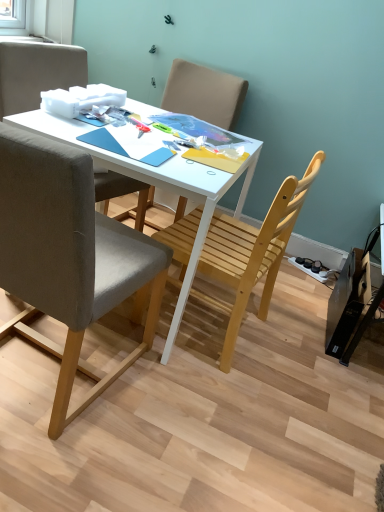
The height and width of the screenshot is (512, 384). Describe the element at coordinates (68, 256) in the screenshot. I see `gray fabric chair at left, acting as the 4th chair starting from the back` at that location.

The height and width of the screenshot is (512, 384). What do you see at coordinates (204, 93) in the screenshot?
I see `light brown wooden chair at center, which is counted as the 1th chair, starting from the back` at bounding box center [204, 93].

The height and width of the screenshot is (512, 384). I want to click on gray fabric chair at left, acting as the 4th chair starting from the back, so click(68, 256).

Is light wood chair at center, placed as the second chair when sorted from front to back, in front of or behind gray fabric chair at left, acting as the 4th chair starting from the back, in the image?

light wood chair at center, placed as the second chair when sorted from front to back, is positioned farther from the viewer than gray fabric chair at left, acting as the 4th chair starting from the back.

Does light wood chair at center, placed as the second chair when sorted from front to back, have a lesser height compared to gray fabric chair at left, acting as the 4th chair starting from the back?

Yes.

Considering the sizes of objects light wood chair at center, placed as the second chair when sorted from front to back, and gray fabric chair at left, which is counted as the first chair, starting from the front, in the image provided, who is smaller, light wood chair at center, placed as the second chair when sorted from front to back, or gray fabric chair at left, which is counted as the first chair, starting from the front,?

light wood chair at center, placed as the second chair when sorted from front to back, is smaller.

Is light wood chair at center, which is the third chair in back-to-front order, situated inside matte gray chair at upper left, marked as the third chair in a front-to-back arrangement, or outside?

The correct answer is: outside.

Are light wood chair at center, placed as the second chair when sorted from front to back, and matte gray chair at upper left, marked as the third chair in a front-to-back arrangement, located far from each other?

No, light wood chair at center, placed as the second chair when sorted from front to back, is not far from matte gray chair at upper left, marked as the third chair in a front-to-back arrangement.

Is light wood chair at center, placed as the second chair when sorted from front to back, taller than matte gray chair at upper left, marked as the third chair in a front-to-back arrangement?

Indeed, light wood chair at center, placed as the second chair when sorted from front to back, has a greater height compared to matte gray chair at upper left, marked as the third chair in a front-to-back arrangement.

What's the angular difference between light wood chair at center, placed as the second chair when sorted from front to back, and matte gray chair at upper left, marked as the third chair in a front-to-back arrangement,'s facing directions?

172 degrees.

From the image's perspective, is white matte desk at center beneath light brown wooden chair at center, which is the 4th chair from front to back?

Correct, white matte desk at center appears lower than light brown wooden chair at center, which is the 4th chair from front to back, in the image.

Is white matte desk at center aimed at light brown wooden chair at center, which is counted as the 1th chair, starting from the back?

No, white matte desk at center does not turn towards light brown wooden chair at center, which is counted as the 1th chair, starting from the back.

From a real-world perspective, which is physically above, white matte desk at center or light brown wooden chair at center, which is counted as the 1th chair, starting from the back?

light brown wooden chair at center, which is counted as the 1th chair, starting from the back.

Which is closer, (57, 130) or (205, 106)?

Point (57, 130).

From the picture: From the image's perspective, does light brown wooden chair at center, which is the 4th chair from front to back, appear higher than gray fabric chair at left, which is counted as the first chair, starting from the front?

Correct, light brown wooden chair at center, which is the 4th chair from front to back, appears higher than gray fabric chair at left, which is counted as the first chair, starting from the front, in the image.

Visually, is light brown wooden chair at center, which is the 4th chair from front to back, positioned to the left or to the right of gray fabric chair at left, which is counted as the first chair, starting from the front?

Clearly, light brown wooden chair at center, which is the 4th chair from front to back, is on the right of gray fabric chair at left, which is counted as the first chair, starting from the front, in the image.

Is light brown wooden chair at center, which is counted as the 1th chair, starting from the back, positioned beyond the bounds of gray fabric chair at left, acting as the 4th chair starting from the back?

light brown wooden chair at center, which is counted as the 1th chair, starting from the back, is positioned outside gray fabric chair at left, acting as the 4th chair starting from the back.

From a real-world perspective, which object stands above the other?

From a 3D spatial view, light brown wooden chair at center, which is counted as the 1th chair, starting from the back, is above.

From a real-world perspective, is light brown wooden chair at center, which is counted as the 1th chair, starting from the back, physically below white matte desk at center?

No, from a real-world perspective, light brown wooden chair at center, which is counted as the 1th chair, starting from the back, is not beneath white matte desk at center.

Is light brown wooden chair at center, which is counted as the 1th chair, starting from the back, far away from white matte desk at center?

light brown wooden chair at center, which is counted as the 1th chair, starting from the back, is near white matte desk at center, not far away.

From the picture: From the image's perspective, is light brown wooden chair at center, which is the 4th chair from front to back, positioned above or below white matte desk at center?

Based on their image positions, light brown wooden chair at center, which is the 4th chair from front to back, is located above white matte desk at center.

Is light brown wooden chair at center, which is counted as the 1th chair, starting from the back, situated inside white matte desk at center or outside?

light brown wooden chair at center, which is counted as the 1th chair, starting from the back, is not enclosed by white matte desk at center.

Can you confirm if light brown wooden chair at center, which is counted as the 1th chair, starting from the back, is taller than light wood chair at center, placed as the second chair when sorted from front to back?

No, light brown wooden chair at center, which is counted as the 1th chair, starting from the back, is not taller than light wood chair at center, placed as the second chair when sorted from front to back.

Is point (208, 120) positioned in front of point (287, 243)?

That is False.

Is light brown wooden chair at center, which is the 4th chair from front to back, positioned with its back to light wood chair at center, placed as the second chair when sorted from front to back?

light brown wooden chair at center, which is the 4th chair from front to back, is not turned away from light wood chair at center, placed as the second chair when sorted from front to back.

Can we say light brown wooden chair at center, which is the 4th chair from front to back, lies outside light wood chair at center, placed as the second chair when sorted from front to back?

Indeed, light brown wooden chair at center, which is the 4th chair from front to back, is completely outside light wood chair at center, placed as the second chair when sorted from front to back.

Would you say white matte desk at center is to the left or to the right of matte gray chair at upper left, the second chair from the back, in the picture?

In the image, white matte desk at center appears on the right side of matte gray chair at upper left, the second chair from the back.

Locate an element on the screen. This screenshot has height=512, width=384. the 2nd chair to the left of the white matte desk at center, counting from the anchor's position is located at coordinates (37, 73).

Does white matte desk at center have a lesser height compared to matte gray chair at upper left, the second chair from the back?

No.

Would you say white matte desk at center is inside or outside matte gray chair at upper left, marked as the third chair in a front-to-back arrangement?

white matte desk at center is located beyond the bounds of matte gray chair at upper left, marked as the third chair in a front-to-back arrangement.

I want to click on the 1st chair behind when counting from the gray fabric chair at left, which is counted as the first chair, starting from the front, so click(253, 250).

From the image's perspective, which chair is the 1st one below the matte gray chair at upper left, the second chair from the back? Please provide its 2D coordinates.

[(253, 250)]

Which object lies further to the anchor point matte gray chair at upper left, the second chair from the back, gray fabric chair at left, acting as the 4th chair starting from the back, or light wood chair at center, which is the third chair in back-to-front order?

light wood chair at center, which is the third chair in back-to-front order, is positioned further to the anchor matte gray chair at upper left, the second chair from the back.

From the image, which object appears to be farther from light wood chair at center, placed as the second chair when sorted from front to back, gray fabric chair at left, acting as the 4th chair starting from the back, or white matte desk at center?

gray fabric chair at left, acting as the 4th chair starting from the back, is positioned further to the anchor light wood chair at center, placed as the second chair when sorted from front to back.

Considering their positions, is white matte desk at center positioned further to light wood chair at center, which is the third chair in back-to-front order, than light brown wooden chair at center, which is the 4th chair from front to back?

light brown wooden chair at center, which is the 4th chair from front to back, lies further to light wood chair at center, which is the third chair in back-to-front order, than the other object.

Which object lies further to the anchor point white matte desk at center, light wood chair at center, placed as the second chair when sorted from front to back, or gray fabric chair at left, acting as the 4th chair starting from the back?

The object further to white matte desk at center is gray fabric chair at left, acting as the 4th chair starting from the back.

Based on the photo, considering their positions, is white matte desk at center positioned further to gray fabric chair at left, acting as the 4th chair starting from the back, than light brown wooden chair at center, which is the 4th chair from front to back?

light brown wooden chair at center, which is the 4th chair from front to back, is further to gray fabric chair at left, acting as the 4th chair starting from the back.

Considering their positions, is gray fabric chair at left, acting as the 4th chair starting from the back, positioned closer to light brown wooden chair at center, which is counted as the 1th chair, starting from the back, than matte gray chair at upper left, the second chair from the back?

matte gray chair at upper left, the second chair from the back, is positioned closer to the anchor light brown wooden chair at center, which is counted as the 1th chair, starting from the back.

When comparing their distances from matte gray chair at upper left, marked as the third chair in a front-to-back arrangement, does white matte desk at center or gray fabric chair at left, which is counted as the first chair, starting from the front, seem closer?

The object closer to matte gray chair at upper left, marked as the third chair in a front-to-back arrangement, is white matte desk at center.

When comparing their distances from white matte desk at center, does light wood chair at center, placed as the second chair when sorted from front to back, or light brown wooden chair at center, which is the 4th chair from front to back, seem further?

light brown wooden chair at center, which is the 4th chair from front to back, lies further to white matte desk at center than the other object.

This screenshot has height=512, width=384. In order to click on desk between matte gray chair at upper left, the second chair from the back, and light wood chair at center, which is the third chair in back-to-front order, in the horizontal direction in this screenshot , I will do `click(157, 180)`.

Where is `chair between light brown wooden chair at center, which is counted as the 1th chair, starting from the back, and white matte desk at center in the up-down direction`? chair between light brown wooden chair at center, which is counted as the 1th chair, starting from the back, and white matte desk at center in the up-down direction is located at coordinates (37, 73).

Identify the location of desk between gray fabric chair at left, which is counted as the first chair, starting from the front, and light brown wooden chair at center, which is the 4th chair from front to back, along the z-axis. This screenshot has height=512, width=384. (157, 180).

Where is `desk between matte gray chair at upper left, the second chair from the back, and gray fabric chair at left, acting as the 4th chair starting from the back, in the vertical direction`? desk between matte gray chair at upper left, the second chair from the back, and gray fabric chair at left, acting as the 4th chair starting from the back, in the vertical direction is located at coordinates (157, 180).